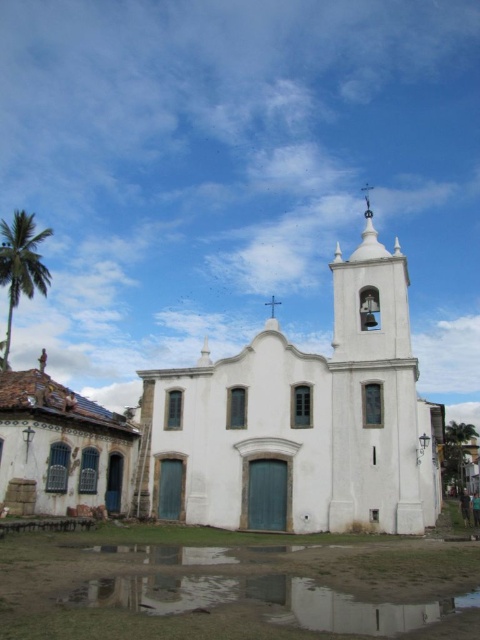
Question: Is rustic clay roof tiles at lower left wider than green leafy palm tree at left?

Choices:
 (A) yes
 (B) no

Answer: (A)

Question: From the image, what is the correct spatial relationship of white stucco chapel at center in relation to green leafy palm tree at left?

Choices:
 (A) left
 (B) right

Answer: (B)

Question: Considering the real-world distances, which object is farthest from the rustic clay roof tiles at lower left?

Choices:
 (A) green leafy palm tree at left
 (B) white stucco chapel at center

Answer: (A)

Question: Among these objects, which one is farthest from the camera?

Choices:
 (A) white stucco chapel at center
 (B) rustic clay roof tiles at lower left
 (C) green leafy palm tree at left

Answer: (C)

Question: Does rustic clay roof tiles at lower left come behind green leafy palm tree at left?

Choices:
 (A) yes
 (B) no

Answer: (B)

Question: Among these points, which one is nearest to the camera?

Choices:
 (A) (304, 488)
 (B) (24, 253)
 (C) (124, 464)

Answer: (A)